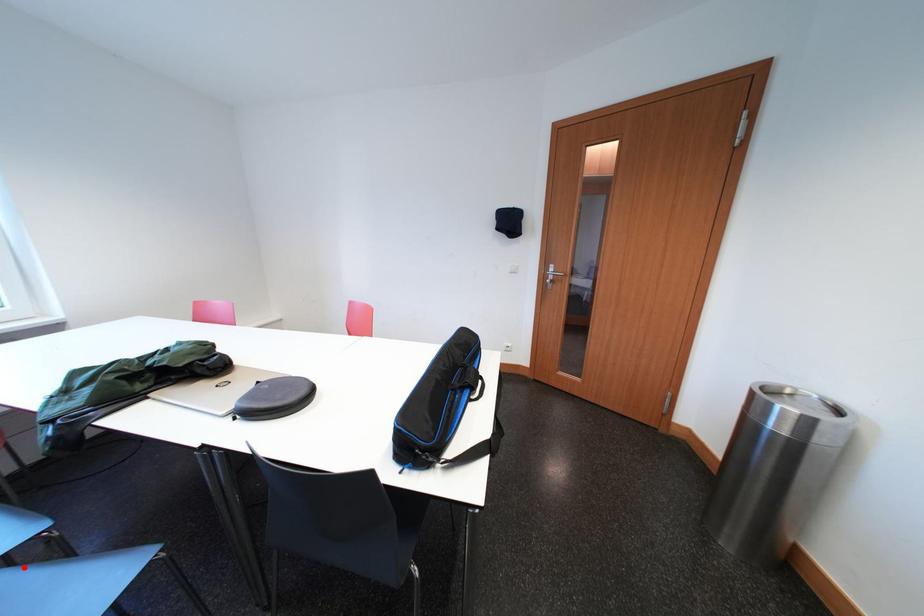
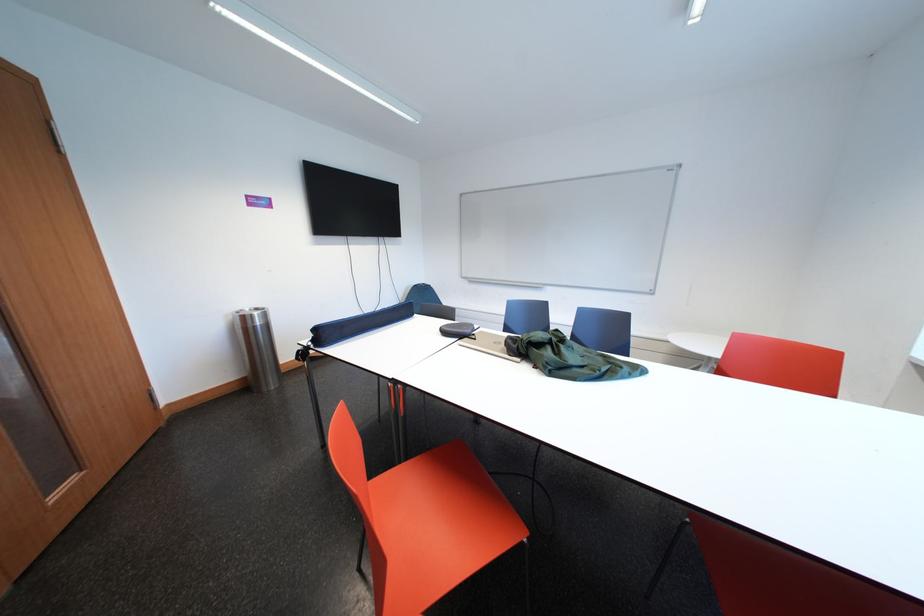
Question: I am providing you with two images of the same scene from different viewpoints. A red point is marked on the first image. Is the red point's position out of view in image 2?

Choices:
 (A) Yes
 (B) No

Answer: (A)